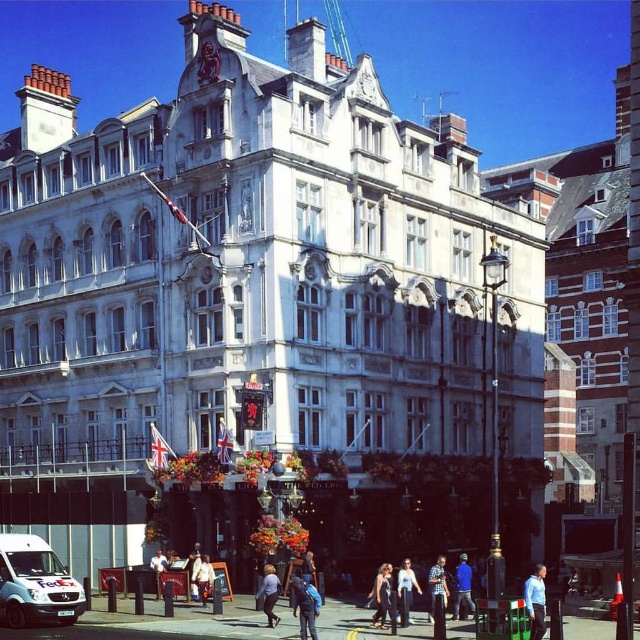
You are standing in front of the grand building and notice two items at the center of the scene. Which item is taller between the blue backpack at center and the blue fabric jacket at center?

The blue backpack at center is taller than the blue fabric jacket at center.

You are standing in the bustling urban scene and need to place a 30 feet long banner between the blue backpack at center and the blue fabric jacket at center. Can the banner fit between them?

The blue backpack at center is 27.09 feet from the blue fabric jacket at center. Since the banner is 30 feet long, which is longer than the distance between them, the banner cannot fit between them.